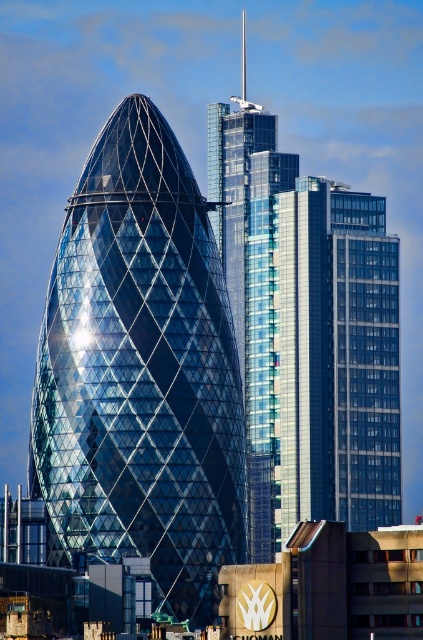
Question: Which of the following is the farthest from the observer?

Choices:
 (A) glassy steel building at center
 (B) shiny glass tower at center

Answer: (A)

Question: Which of the following is the closest to the observer?

Choices:
 (A) glassy steel building at center
 (B) shiny glass tower at center

Answer: (B)

Question: Does shiny glass tower at center come behind glassy steel building at center?

Choices:
 (A) no
 (B) yes

Answer: (A)

Question: Does shiny glass tower at center appear under glassy steel building at center?

Choices:
 (A) yes
 (B) no

Answer: (A)

Question: Is the position of shiny glass tower at center less distant than that of glassy steel building at center?

Choices:
 (A) no
 (B) yes

Answer: (B)